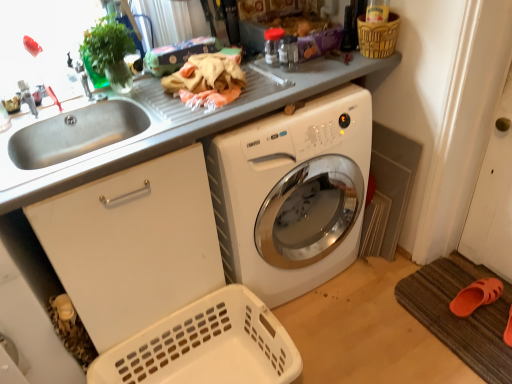
Locate an element on the screen. This screenshot has width=512, height=384. blank space to the left of brown textured bath mat at lower right is located at coordinates (370, 327).